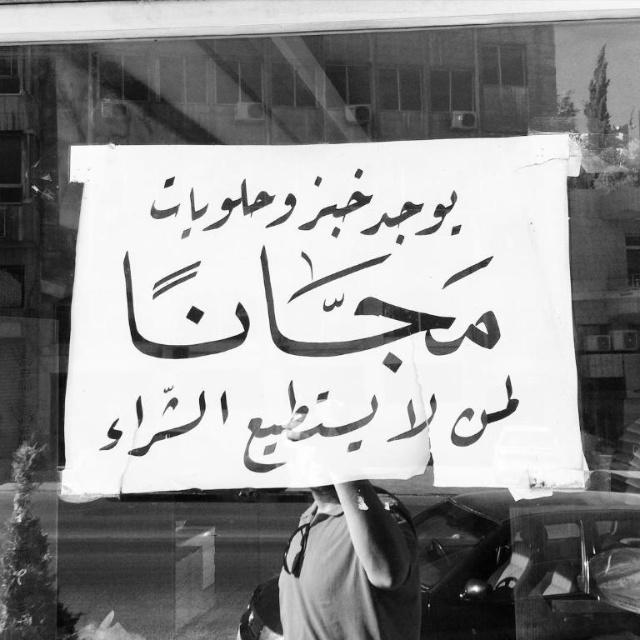
Looking at this image, you are a delivery person who needs to read the sign to complete your task. However, the transparent glass window at upper left is reflecting the surroundings. Can you read the white paper sign at center clearly?

The white paper sign at center is in front of transparent glass window at upper left, so the reflection from the window might make it difficult to read the sign clearly.

In the scene shown: What is the exact position of the white paper sign at center in the image?

The white paper sign at center is located at point coordinates of (321, 316).